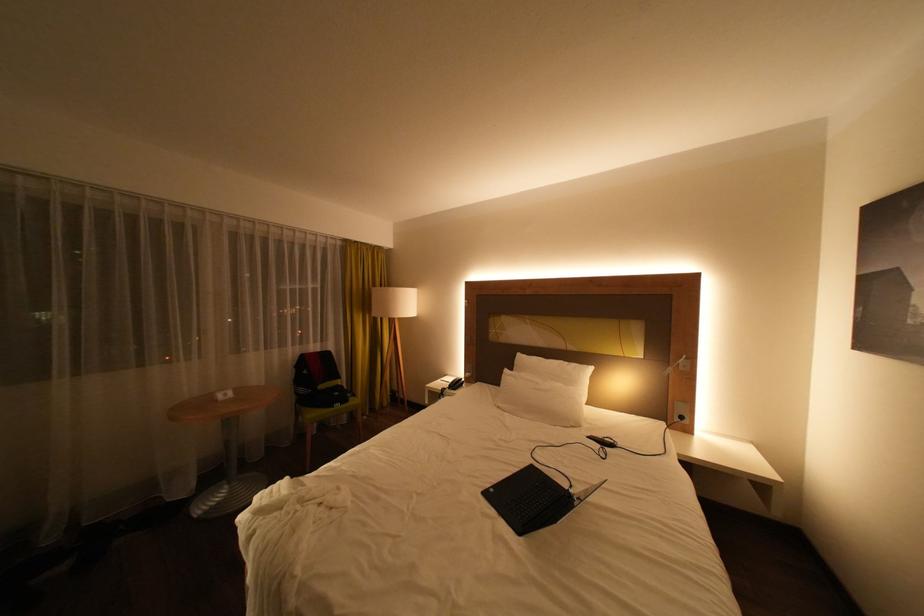
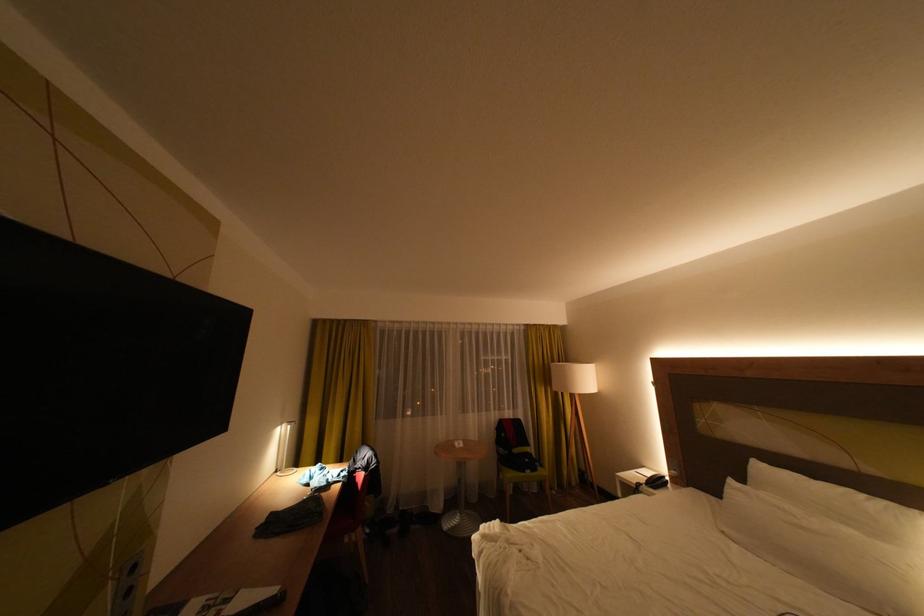
Locate, in the second image, the point that corresponds to [581,382] in the first image.

(893, 533)